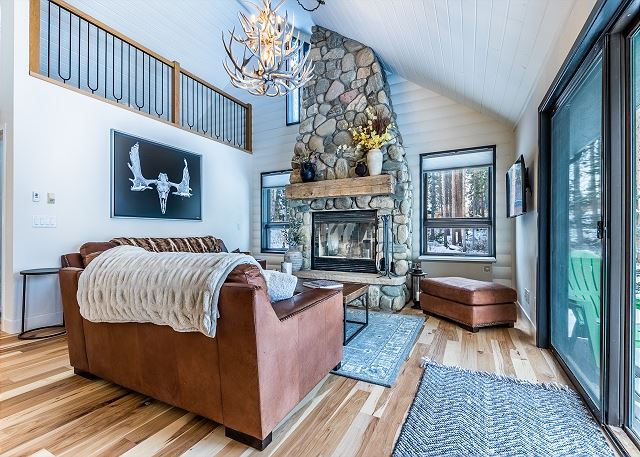
Where is `skull picture of animal`? skull picture of animal is located at coordinates (121, 144), (163, 148), (195, 160), (192, 208), (129, 210).